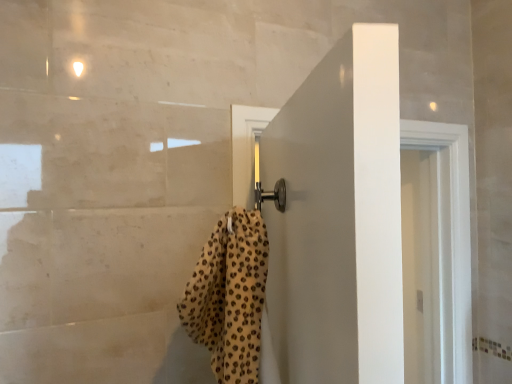
Question: From their relative heights in the image, would you say leopard print towel at center is taller or shorter than white matte door at center?

Choices:
 (A) tall
 (B) short

Answer: (B)

Question: Considering their positions, is leopard print towel at center located in front of or behind white matte door at center?

Choices:
 (A) front
 (B) behind

Answer: (A)

Question: Which is correct: leopard print towel at center is inside white matte door at center, or outside of it?

Choices:
 (A) inside
 (B) outside

Answer: (B)

Question: In terms of width, does white matte door at center look wider or thinner when compared to leopard print towel at center?

Choices:
 (A) wide
 (B) thin

Answer: (B)

Question: Do you think white matte door at center is within leopard print towel at center, or outside of it?

Choices:
 (A) outside
 (B) inside

Answer: (A)

Question: Is white matte door at center taller or shorter than leopard print towel at center?

Choices:
 (A) short
 (B) tall

Answer: (B)

Question: Does point [x=381, y=279] appear closer or farther from the camera than point [x=211, y=354]?

Choices:
 (A) farther
 (B) closer

Answer: (B)